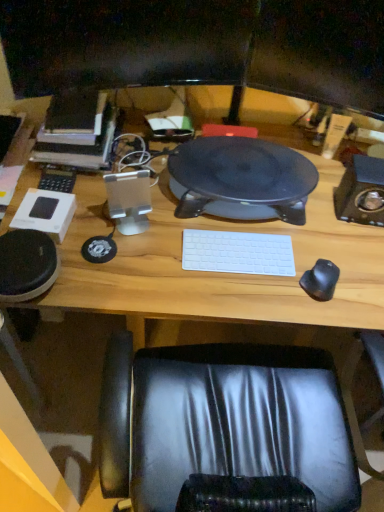
At what (x,y) coordinates should I click in order to perform the action: click on vacant region above white matte keyboard at center (from a real-world perspective). Please return your answer as a coordinate pair (x, y). This screenshot has width=384, height=512. Looking at the image, I should click on (236, 249).